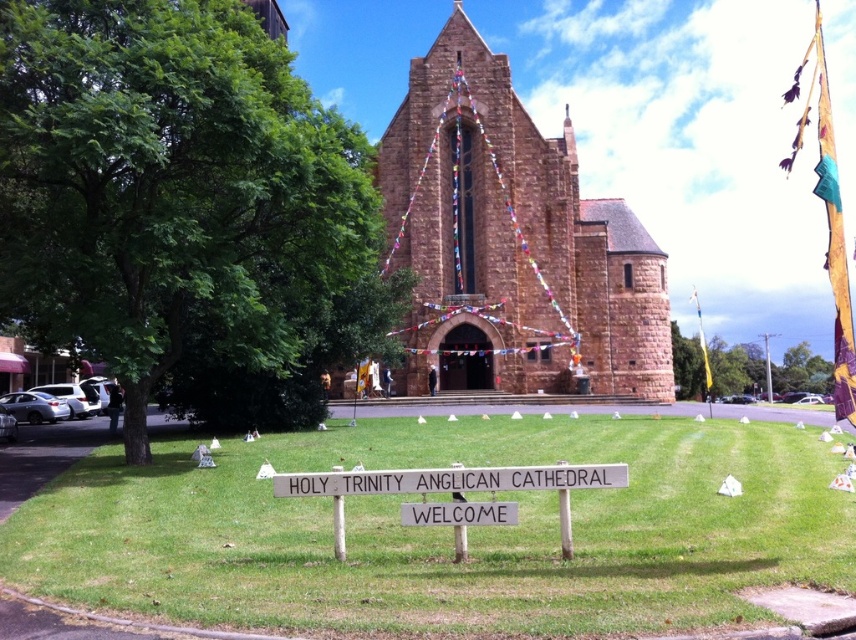
Question: Among these objects, which one is nearest to the camera?

Choices:
 (A) white wooden sign at center
 (B) brown stone church at center
 (C) green grass at center
 (D) green leafy tree at left

Answer: (C)

Question: Which of the following is the farthest from the observer?

Choices:
 (A) (749, 358)
 (B) (15, 554)
 (C) (76, 228)

Answer: (A)

Question: Does green leafy tree at left have a greater width compared to green leafy tree at upper center?

Choices:
 (A) no
 (B) yes

Answer: (B)

Question: Does green leafy tree at left have a smaller size compared to brown stone church at center?

Choices:
 (A) yes
 (B) no

Answer: (A)

Question: Which point is farther to the camera?

Choices:
 (A) green leafy tree at left
 (B) white wooden sign at center

Answer: (A)

Question: Is green grass at center positioned before green leafy tree at left?

Choices:
 (A) yes
 (B) no

Answer: (A)